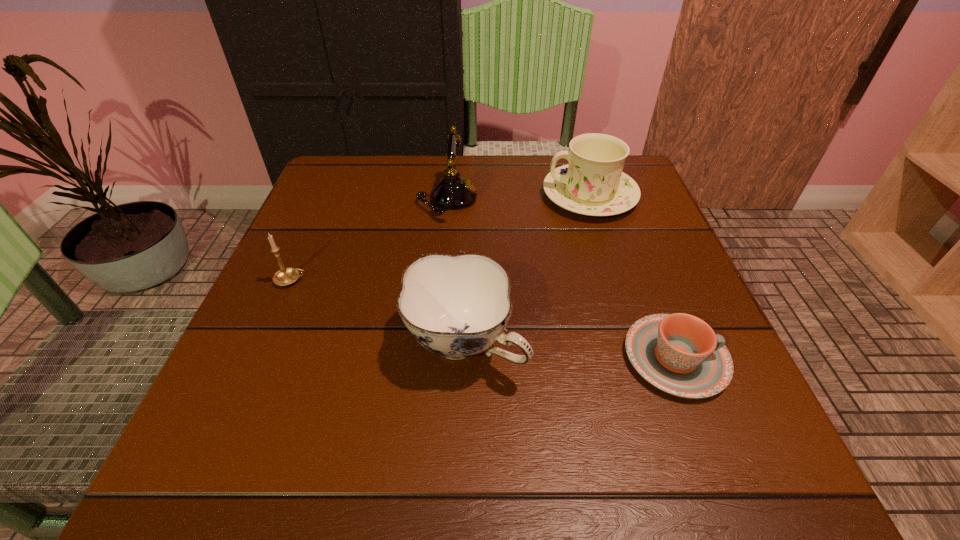
Identify the location of free point located on the left of the leftmost chinaware. (303, 343).

The height and width of the screenshot is (540, 960). I want to click on vacant space located 0.390m on the handle side of the candle holder, so click(515, 280).

Where is `telephone situated at the far edge`? This screenshot has width=960, height=540. telephone situated at the far edge is located at coordinates (453, 192).

Where is `chinaware at the far edge`? This screenshot has width=960, height=540. chinaware at the far edge is located at coordinates (593, 184).

I want to click on object positioned at the left edge, so click(x=285, y=276).

Where is `object located in the far right corner section of the desktop`? Image resolution: width=960 pixels, height=540 pixels. object located in the far right corner section of the desktop is located at coordinates tap(593, 184).

Image resolution: width=960 pixels, height=540 pixels. In the image, there is a desktop. In order to click on vacant area at the far edge in this screenshot , I will do `click(527, 168)`.

At what (x,y) coordinates should I click in order to perform the action: click on vacant space at the near edge. Please return your answer as a coordinate pair (x, y). This screenshot has width=960, height=540. Looking at the image, I should click on (x=403, y=483).

In order to click on free space at the left edge of the desktop in this screenshot , I will do [344, 237].

In the image, there is a desktop. Where is `free space at the far left corner`? The width and height of the screenshot is (960, 540). free space at the far left corner is located at coordinates (382, 178).